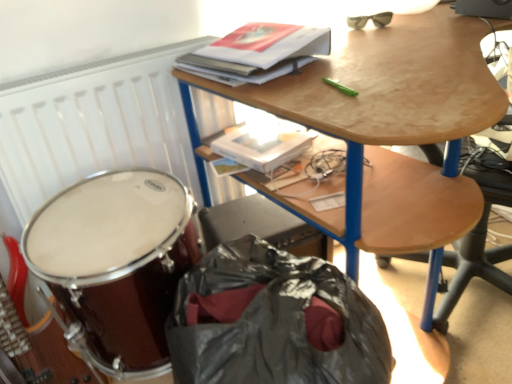
Question: Based on their positions, is hardcover book at upper center located to the left or right of wooden desk at upper center?

Choices:
 (A) right
 (B) left

Answer: (B)

Question: Considering the positions of point (272, 29) and point (175, 72), is point (272, 29) closer or farther from the camera than point (175, 72)?

Choices:
 (A) closer
 (B) farther

Answer: (A)

Question: Which is nearer to the matte black sunglasses at upper right?

Choices:
 (A) hardcover book at upper center
 (B) wooden desk at upper center
 (C) white matte radiator at upper left
 (D) shiny brown drum at lower left
 (E) shiny black handbag at lower left

Answer: (A)

Question: Based on their relative distances, which object is nearer to the hardcover book at upper center?

Choices:
 (A) white matte radiator at upper left
 (B) shiny brown drum at lower left
 (C) wooden desk at upper center
 (D) shiny black handbag at lower left
 (E) matte black sunglasses at upper right

Answer: (C)